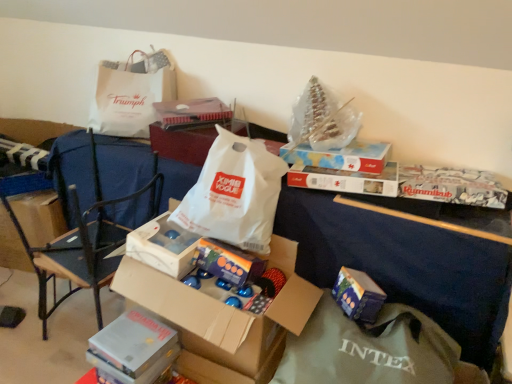
Question: Is shiny metallic box at center, the first gift when ordered from left to right, facing away from cardboard box at center?

Choices:
 (A) no
 (B) yes

Answer: (B)

Question: Is shiny metallic box at center, the first gift when ordered from left to right, taller than cardboard box at center?

Choices:
 (A) no
 (B) yes

Answer: (A)

Question: From a real-world perspective, is shiny metallic box at center, the first gift when ordered from left to right, located beneath cardboard box at center?

Choices:
 (A) yes
 (B) no

Answer: (B)

Question: Can you confirm if shiny metallic box at center, the first gift when ordered from left to right, is thinner than cardboard box at center?

Choices:
 (A) yes
 (B) no

Answer: (A)

Question: Can you confirm if shiny metallic box at center, the first gift when ordered from left to right, is wider than cardboard box at center?

Choices:
 (A) no
 (B) yes

Answer: (A)

Question: Is shiny metallic box at center, the first gift when ordered from left to right, at the left side of cardboard box at center?

Choices:
 (A) no
 (B) yes

Answer: (B)

Question: Is white paper bag at center, which ranks as the 5th storage box in bottom-to-top order, to the right of cardboard box at center from the viewer's perspective?

Choices:
 (A) no
 (B) yes

Answer: (A)

Question: Is the surface of white paper bag at center, which ranks as the 5th storage box in bottom-to-top order, in direct contact with cardboard box at center?

Choices:
 (A) no
 (B) yes

Answer: (A)

Question: Is white paper bag at center, placed as the 1th storage box when sorted from top to bottom, at the left side of cardboard box at center?

Choices:
 (A) no
 (B) yes

Answer: (B)

Question: Considering the relative sizes of white paper bag at center, placed as the 1th storage box when sorted from top to bottom, and cardboard box at center in the image provided, is white paper bag at center, placed as the 1th storage box when sorted from top to bottom, taller than cardboard box at center?

Choices:
 (A) yes
 (B) no

Answer: (B)

Question: Is white paper bag at center, placed as the 1th storage box when sorted from top to bottom, facing away from cardboard box at center?

Choices:
 (A) yes
 (B) no

Answer: (B)

Question: Could cardboard box at center be considered to be inside white paper bag at center, placed as the 1th storage box when sorted from top to bottom?

Choices:
 (A) no
 (B) yes

Answer: (A)

Question: Is black metal chair at left bigger than white paper bag at upper left, which ranks as the 2th grocery bag in front-to-back order?

Choices:
 (A) yes
 (B) no

Answer: (A)